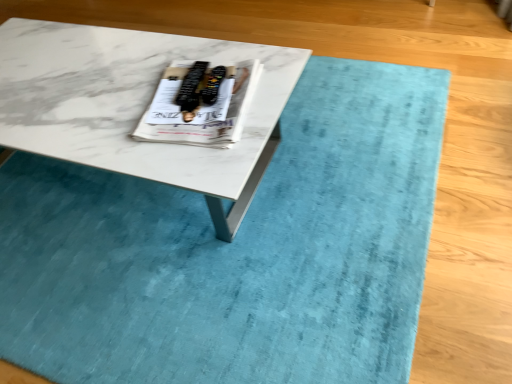
Question: Is the position of white glossy magazine at center more distant than that of white marble coffee table at center?

Choices:
 (A) yes
 (B) no

Answer: (A)

Question: From the image's perspective, is white glossy magazine at center located beneath white marble coffee table at center?

Choices:
 (A) no
 (B) yes

Answer: (A)

Question: Is white glossy magazine at center positioned far away from white marble coffee table at center?

Choices:
 (A) yes
 (B) no

Answer: (B)

Question: Is white glossy magazine at center oriented away from white marble coffee table at center?

Choices:
 (A) no
 (B) yes

Answer: (A)

Question: From a real-world perspective, does white glossy magazine at center sit lower than white marble coffee table at center?

Choices:
 (A) yes
 (B) no

Answer: (B)

Question: Is white glossy magazine at center wider than white marble coffee table at center?

Choices:
 (A) no
 (B) yes

Answer: (A)

Question: Does white marble coffee table at center contain white glossy magazine at center?

Choices:
 (A) no
 (B) yes

Answer: (A)

Question: From a real-world perspective, is white marble coffee table at center under white glossy magazine at center?

Choices:
 (A) no
 (B) yes

Answer: (B)

Question: Is white marble coffee table at center bigger than white glossy magazine at center?

Choices:
 (A) no
 (B) yes

Answer: (B)

Question: Considering the relative sizes of white marble coffee table at center and white glossy magazine at center in the image provided, is white marble coffee table at center taller than white glossy magazine at center?

Choices:
 (A) no
 (B) yes

Answer: (B)

Question: Considering the relative positions of white marble coffee table at center and white glossy magazine at center in the image provided, is white marble coffee table at center to the left of white glossy magazine at center from the viewer's perspective?

Choices:
 (A) no
 (B) yes

Answer: (B)

Question: Is the depth of white marble coffee table at center greater than that of white glossy magazine at center?

Choices:
 (A) no
 (B) yes

Answer: (A)

Question: In terms of height, does white marble coffee table at center look taller or shorter compared to white glossy magazine at center?

Choices:
 (A) short
 (B) tall

Answer: (B)